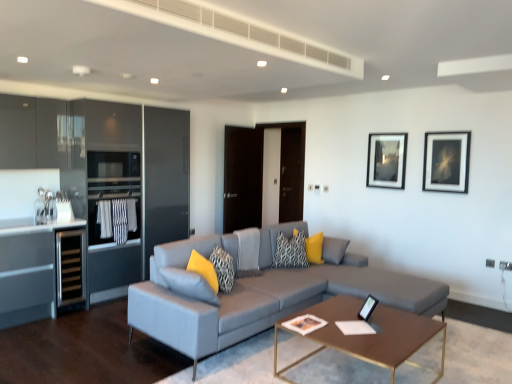
Question: Is yellow fabric pillow at center, which is counted as the first pillow, starting from the back, smaller than brown metallic coffee table at center?

Choices:
 (A) no
 (B) yes

Answer: (B)

Question: Can you confirm if yellow fabric pillow at center, which is counted as the first pillow, starting from the back, is bigger than brown metallic coffee table at center?

Choices:
 (A) no
 (B) yes

Answer: (A)

Question: Can you confirm if yellow fabric pillow at center, the fourth pillow positioned from the front, is positioned to the right of brown metallic coffee table at center?

Choices:
 (A) yes
 (B) no

Answer: (B)

Question: Considering the relative positions of yellow fabric pillow at center, arranged as the fourth pillow when viewed from the left, and brown metallic coffee table at center in the image provided, is yellow fabric pillow at center, arranged as the fourth pillow when viewed from the left, behind brown metallic coffee table at center?

Choices:
 (A) no
 (B) yes

Answer: (B)

Question: Is yellow fabric pillow at center, the 1th pillow positioned from the right, completely or partially outside of brown metallic coffee table at center?

Choices:
 (A) yes
 (B) no

Answer: (A)

Question: Considering the relative sizes of yellow fabric pillow at center, the fourth pillow positioned from the front, and brown metallic coffee table at center in the image provided, is yellow fabric pillow at center, the fourth pillow positioned from the front, taller than brown metallic coffee table at center?

Choices:
 (A) no
 (B) yes

Answer: (A)

Question: Would you say textured gray pillow at center, positioned as the 2th pillow in front-to-back order, is part of yellow fabric pillow at center, which is counted as the first pillow, starting from the back,'s contents?

Choices:
 (A) no
 (B) yes

Answer: (A)

Question: From a real-world perspective, is yellow fabric pillow at center, the 1th pillow positioned from the right, over textured gray pillow at center, positioned as the 2th pillow in front-to-back order?

Choices:
 (A) no
 (B) yes

Answer: (B)

Question: Could you tell me if yellow fabric pillow at center, arranged as the fourth pillow when viewed from the left, is turned towards textured gray pillow at center, which ranks as the 3th pillow in back-to-front order?

Choices:
 (A) yes
 (B) no

Answer: (B)

Question: Considering the relative positions of yellow fabric pillow at center, arranged as the fourth pillow when viewed from the left, and textured gray pillow at center, the second pillow from the left, in the image provided, is yellow fabric pillow at center, arranged as the fourth pillow when viewed from the left, to the right of textured gray pillow at center, the second pillow from the left, from the viewer's perspective?

Choices:
 (A) no
 (B) yes

Answer: (B)

Question: Are yellow fabric pillow at center, the 1th pillow positioned from the right, and textured gray pillow at center, positioned as the 2th pillow in front-to-back order, beside each other?

Choices:
 (A) yes
 (B) no

Answer: (B)

Question: Is yellow fabric pillow at center, which is counted as the first pillow, starting from the back, completely or partially outside of textured gray pillow at center, arranged as the third pillow when viewed from the right?

Choices:
 (A) yes
 (B) no

Answer: (A)

Question: Is matte black picture frame at upper right, which is the first picture frame from right to left, to the right of textured gray pillow at center, which ranks as the 3th pillow in back-to-front order, from the viewer's perspective?

Choices:
 (A) yes
 (B) no

Answer: (A)